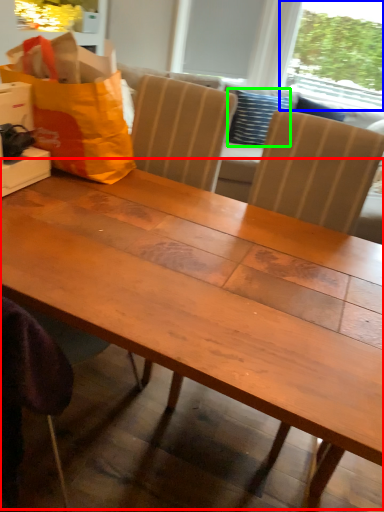
Question: Considering the real-world distances, which object is closest to table (highlighted by a red box)? window screen (highlighted by a blue box) or pillow (highlighted by a green box).

Choices:
 (A) window screen
 (B) pillow

Answer: (B)